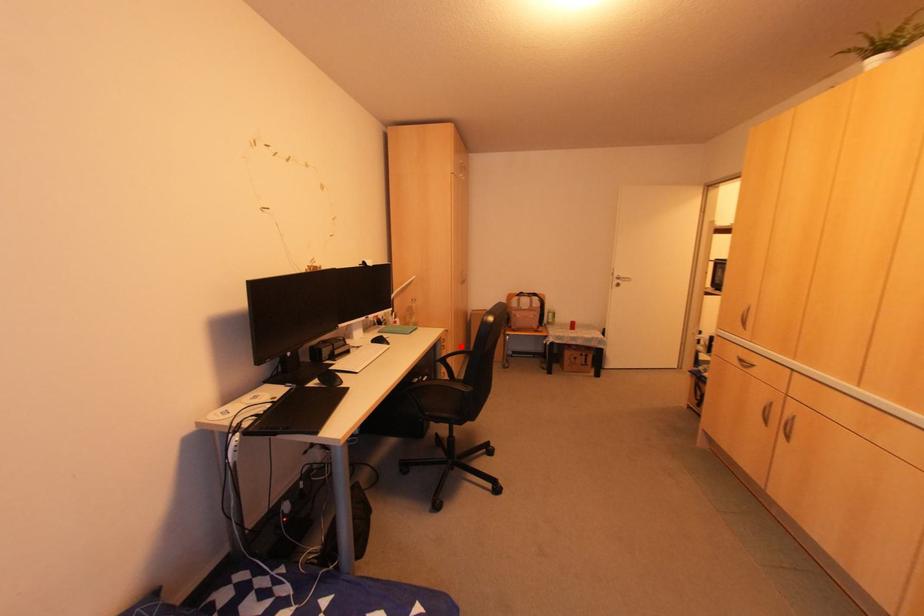
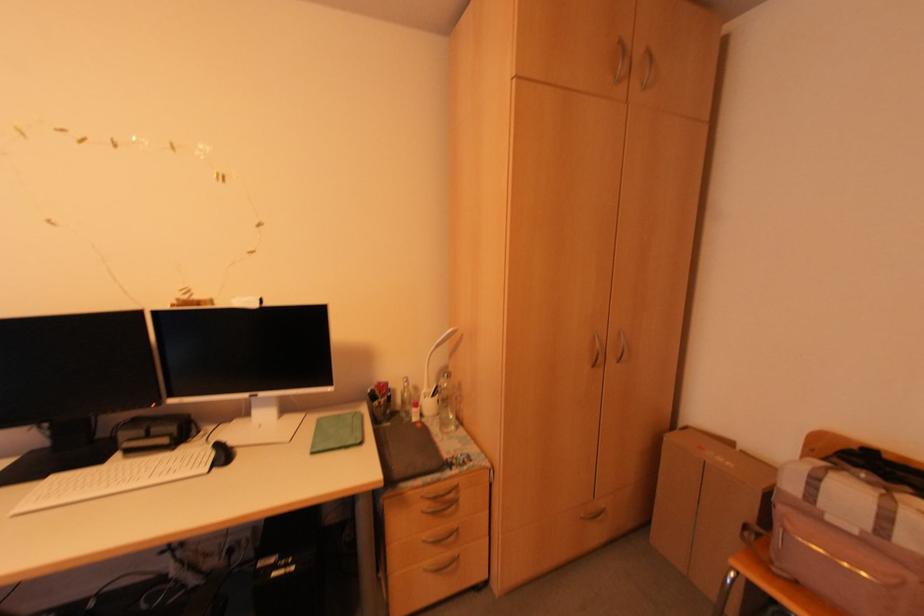
In the second image, find the point that corresponds to the highlighted location in the first image.

(602, 506)